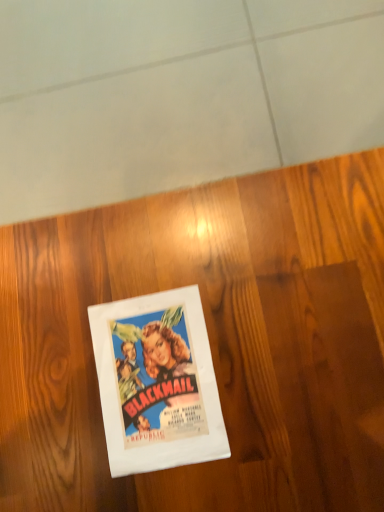
This screenshot has height=512, width=384. I want to click on free space on the front side of white paper at center, so click(247, 463).